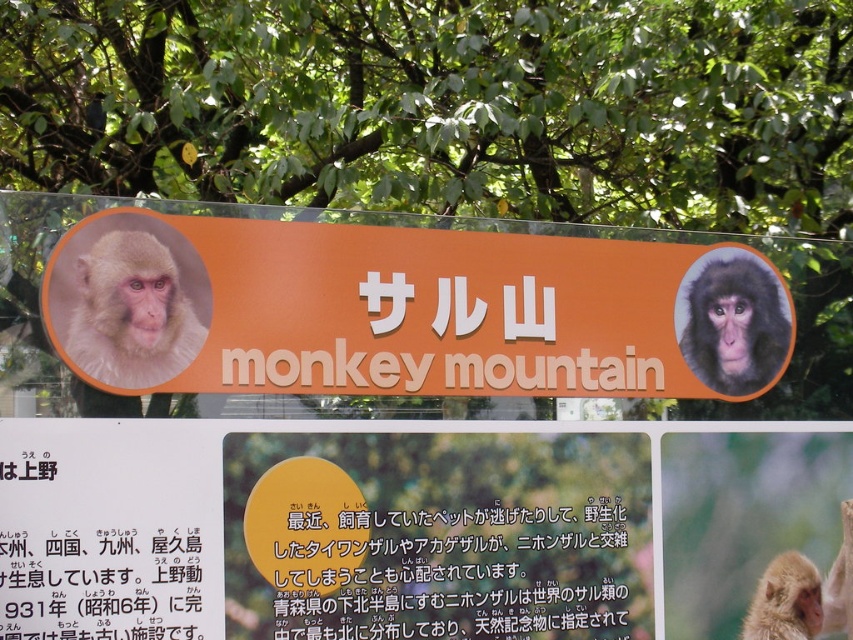
You are a hiker who wants to take a photo of the dark brown fur monkey at upper right without any obstructions. Is the green leafy tree at upper center blocking your view of the monkey?

The dark brown fur monkey at upper right is behind the green leafy tree at upper center, so the tree is blocking your view of the monkey. Move to a different position to get an unobstructed shot.

You are a graphic designer reviewing the signboard. You need to ensure that the black paper at lower left and the light brown fur monkey at left are visible to a passerby standing 5 meters away. Which object might be harder to see and why?

The black paper at lower left has a lesser height compared to the light brown fur monkey at left, so it might be harder to see from a distance because it is smaller in size.

You are standing in front of the signboard and want to take a photo that includes both the signboard and the green leafy tree at upper center. Based on their positions, where should you position yourself relative to the signboard to ensure both are in the frame?

The green leafy tree at upper center is located at point (442, 106), so you should position yourself to the left of the signboard to include both the signboard and the tree in the frame.